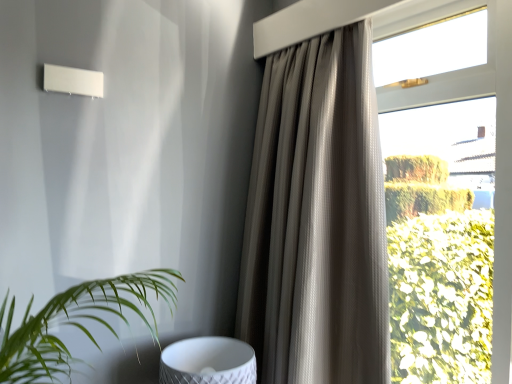
Question: Is textured taupe curtain at upper right to the left or to the right of white textured swivel chair at lower center in the image?

Choices:
 (A) left
 (B) right

Answer: (B)

Question: Considering their positions, is textured taupe curtain at upper right located in front of or behind white textured swivel chair at lower center?

Choices:
 (A) behind
 (B) front

Answer: (B)

Question: Considering the positions of textured taupe curtain at upper right and white textured swivel chair at lower center in the image, is textured taupe curtain at upper right wider or thinner than white textured swivel chair at lower center?

Choices:
 (A) thin
 (B) wide

Answer: (A)

Question: Choose the correct answer: Is white textured swivel chair at lower center inside textured taupe curtain at upper right or outside it?

Choices:
 (A) outside
 (B) inside

Answer: (A)

Question: In terms of width, does white textured swivel chair at lower center look wider or thinner when compared to textured taupe curtain at upper right?

Choices:
 (A) wide
 (B) thin

Answer: (A)

Question: Looking at the image, does white textured swivel chair at lower center seem bigger or smaller compared to textured taupe curtain at upper right?

Choices:
 (A) small
 (B) big

Answer: (A)

Question: Is point (166, 357) closer or farther from the camera than point (339, 283)?

Choices:
 (A) farther
 (B) closer

Answer: (A)